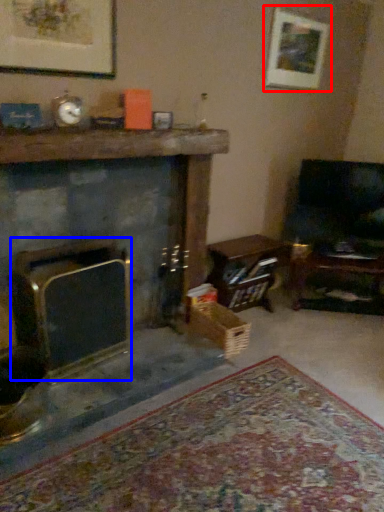
Question: Which object is closer to the camera taking this photo, picture frame (highlighted by a red box) or fireplace (highlighted by a blue box)?

Choices:
 (A) picture frame
 (B) fireplace

Answer: (B)